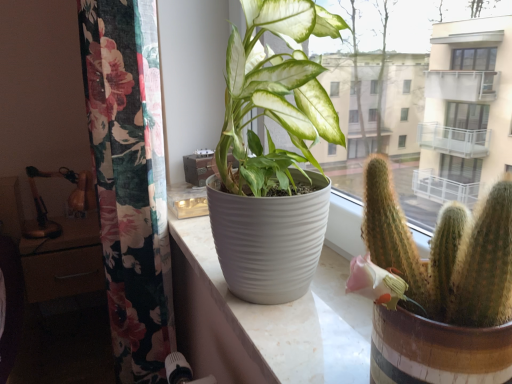
Question: Is the depth of matte brown drawer at left greater than that of green spiky cactus at right?

Choices:
 (A) yes
 (B) no

Answer: (A)

Question: Does matte brown drawer at left appear on the left side of green spiky cactus at right?

Choices:
 (A) yes
 (B) no

Answer: (A)

Question: From the image's perspective, is matte brown drawer at left on green spiky cactus at right?

Choices:
 (A) no
 (B) yes

Answer: (A)

Question: Is matte brown drawer at left thinner than green spiky cactus at right?

Choices:
 (A) no
 (B) yes

Answer: (A)

Question: From the image's perspective, is matte brown drawer at left beneath green spiky cactus at right?

Choices:
 (A) no
 (B) yes

Answer: (B)

Question: From their relative heights in the image, would you say floral fabric curtain at left is taller or shorter than white ribbed pot at center?

Choices:
 (A) tall
 (B) short

Answer: (A)

Question: Visually, is floral fabric curtain at left positioned to the left or to the right of white ribbed pot at center?

Choices:
 (A) left
 (B) right

Answer: (A)

Question: Does point (117, 109) appear closer or farther from the camera than point (309, 344)?

Choices:
 (A) closer
 (B) farther

Answer: (B)

Question: Is floral fabric curtain at left bigger or smaller than white ribbed pot at center?

Choices:
 (A) big
 (B) small

Answer: (A)

Question: From the image's perspective, is green spiky cactus at right positioned above or below floral fabric curtain at left?

Choices:
 (A) above
 (B) below

Answer: (A)

Question: Is point (504, 324) positioned closer to the camera than point (128, 8)?

Choices:
 (A) closer
 (B) farther

Answer: (A)

Question: From a real-world perspective, is green spiky cactus at right physically located above or below floral fabric curtain at left?

Choices:
 (A) below
 (B) above

Answer: (B)

Question: Considering the relative positions of green spiky cactus at right and floral fabric curtain at left in the image provided, is green spiky cactus at right to the left or to the right of floral fabric curtain at left?

Choices:
 (A) left
 (B) right

Answer: (B)

Question: From the image's perspective, is matte brown drawer at left located above or below white ribbed pot at center?

Choices:
 (A) above
 (B) below

Answer: (B)

Question: Considering the positions of matte brown drawer at left and white ribbed pot at center in the image, is matte brown drawer at left taller or shorter than white ribbed pot at center?

Choices:
 (A) tall
 (B) short

Answer: (A)